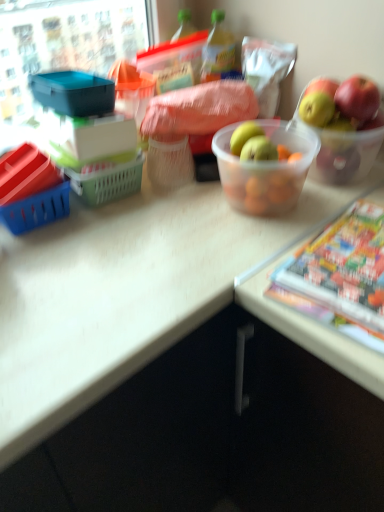
Question: From a real-world perspective, is translucent plastic bowl at center physically located above or below multicolored glossy comic book at lower right?

Choices:
 (A) above
 (B) below

Answer: (A)

Question: Based on their sizes in the image, would you say translucent plastic bowl at center is bigger or smaller than multicolored glossy comic book at lower right?

Choices:
 (A) small
 (B) big

Answer: (B)

Question: Estimate the real-world distances between objects in this image. Which object is farther from the green plastic bottle at center?

Choices:
 (A) multicolored glossy comic book at lower right
 (B) translucent plastic bowl at center

Answer: (A)

Question: Estimate the real-world distances between objects in this image. Which object is farther from the multicolored glossy comic book at lower right?

Choices:
 (A) translucent plastic bowl at center
 (B) green plastic bottle at center

Answer: (B)